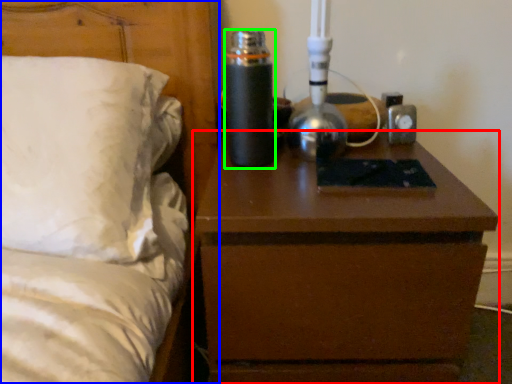
Question: Based on their relative distances, which object is nearer to nightstand (highlighted by a red box)? Choose from bed (highlighted by a blue box) and bottle (highlighted by a green box).

Choices:
 (A) bed
 (B) bottle

Answer: (B)